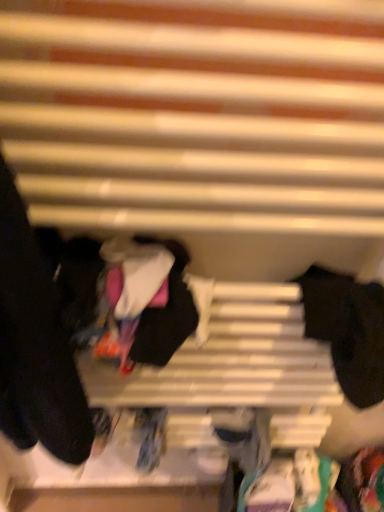
Question: Would you say black matte socks at left, acting as the 2th clothing starting from the right, is outside black matte socks at right, placed as the second clothing when sorted from left to right?

Choices:
 (A) no
 (B) yes

Answer: (B)

Question: Is black matte socks at left, acting as the 2th clothing starting from the right, positioned behind black matte socks at right, which is the 1th clothing from right to left?

Choices:
 (A) yes
 (B) no

Answer: (B)

Question: From the image's perspective, would you say black matte socks at left, which is the 1th clothing from left to right, is positioned over black matte socks at right, which is the 1th clothing from right to left?

Choices:
 (A) no
 (B) yes

Answer: (B)

Question: Can black matte socks at right, placed as the second clothing when sorted from left to right, be found inside black matte socks at left, which is the 1th clothing from left to right?

Choices:
 (A) yes
 (B) no

Answer: (B)

Question: From the image's perspective, is black matte socks at left, acting as the 2th clothing starting from the right, under black matte socks at right, which is the 1th clothing from right to left?

Choices:
 (A) no
 (B) yes

Answer: (A)

Question: Considering the relative sizes of black matte socks at left, acting as the 2th clothing starting from the right, and black matte socks at right, placed as the second clothing when sorted from left to right, in the image provided, is black matte socks at left, acting as the 2th clothing starting from the right, smaller than black matte socks at right, placed as the second clothing when sorted from left to right,?

Choices:
 (A) yes
 (B) no

Answer: (B)

Question: Is the surface of black matte socks at right, placed as the second clothing when sorted from left to right, in direct contact with black matte socks at left, which is the 1th clothing from left to right?

Choices:
 (A) no
 (B) yes

Answer: (A)

Question: Does black matte socks at right, placed as the second clothing when sorted from left to right, have a greater width compared to black matte socks at left, which is the 1th clothing from left to right?

Choices:
 (A) yes
 (B) no

Answer: (B)

Question: Considering the relative sizes of black matte socks at right, which is the 1th clothing from right to left, and black matte socks at left, acting as the 2th clothing starting from the right, in the image provided, is black matte socks at right, which is the 1th clothing from right to left, shorter than black matte socks at left, acting as the 2th clothing starting from the right,?

Choices:
 (A) no
 (B) yes

Answer: (B)

Question: From a real-world perspective, is black matte socks at right, placed as the second clothing when sorted from left to right, positioned under black matte socks at left, acting as the 2th clothing starting from the right, based on gravity?

Choices:
 (A) no
 (B) yes

Answer: (B)

Question: Does black matte socks at right, which is the 1th clothing from right to left, appear on the right side of black matte socks at left, which is the 1th clothing from left to right?

Choices:
 (A) no
 (B) yes

Answer: (B)

Question: Is the position of black matte socks at right, which is the 1th clothing from right to left, more distant than that of black matte socks at left, acting as the 2th clothing starting from the right?

Choices:
 (A) yes
 (B) no

Answer: (A)

Question: Based on their positions, is black matte socks at right, which is the 1th clothing from right to left, located to the left or right of black matte socks at left, acting as the 2th clothing starting from the right?

Choices:
 (A) right
 (B) left

Answer: (A)